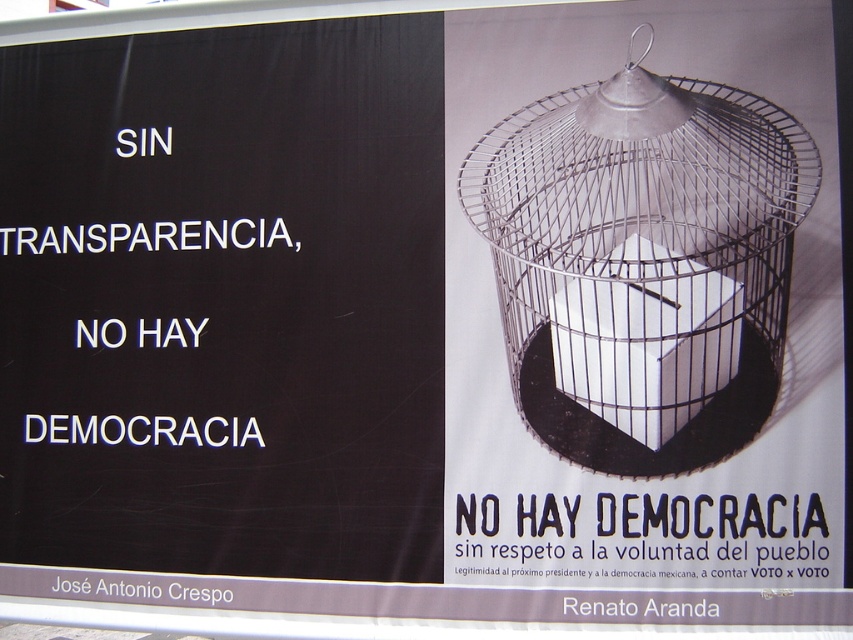
Question: Is metallic wire birdcage at right positioned at the back of black paper at upper center?

Choices:
 (A) yes
 (B) no

Answer: (A)

Question: Which object is closer to the camera taking this photo?

Choices:
 (A) black paper at upper center
 (B) metallic wire birdcage at right

Answer: (A)

Question: Does metallic wire birdcage at right appear on the left side of black paper at upper center?

Choices:
 (A) yes
 (B) no

Answer: (A)

Question: Does metallic wire birdcage at right appear on the left side of black paper at upper center?

Choices:
 (A) yes
 (B) no

Answer: (A)